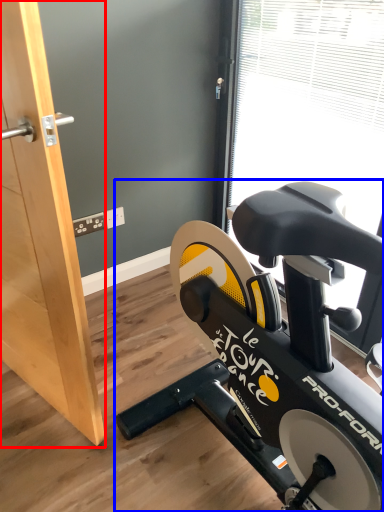
Question: Among these objects, which one is nearest to the camera, screen door (highlighted by a red box) or stationary bicycle (highlighted by a blue box)?

Choices:
 (A) screen door
 (B) stationary bicycle

Answer: (A)